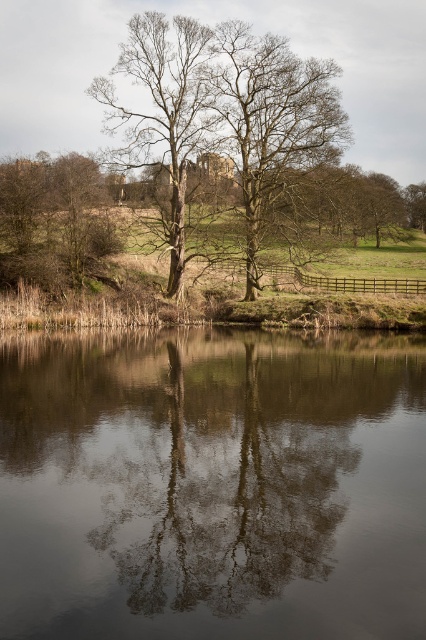
You are an artist trying to paint the scene. You want to ensure the brown rough bark tree at left is positioned above its reflection in the smooth reflective water at center. Based on the scene, is this arrangement accurate?

Yes, the smooth reflective water at center is below the brown rough bark tree at left, so the tree is positioned above its reflection in the water.

You are standing in the landscape scene and want to walk towards the smooth brown tree at center. Which direction should you go to avoid stepping on the smooth reflective water at center?

To avoid stepping on the smooth reflective water at center, you should walk towards the smooth brown tree at center in a direction that goes around the water since the water is in front of the tree, meaning the tree is behind the water. Moving to either side of the water would allow you to reach the tree without stepping on the water.